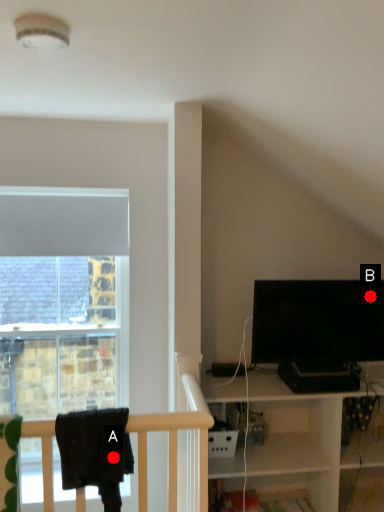
Question: Two points are circled on the image, labeled by A and B beside each circle. Which point is farther to the camera?

Choices:
 (A) A is further
 (B) B is further

Answer: (B)